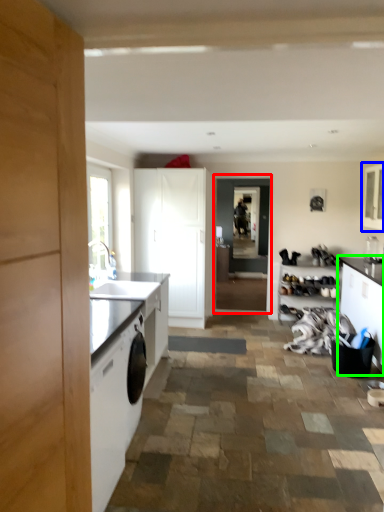
Question: Which is nearer to the screen door (highlighted by a red box)? cabinetry (highlighted by a blue box) or cabinetry (highlighted by a green box).

Choices:
 (A) cabinetry
 (B) cabinetry

Answer: (A)